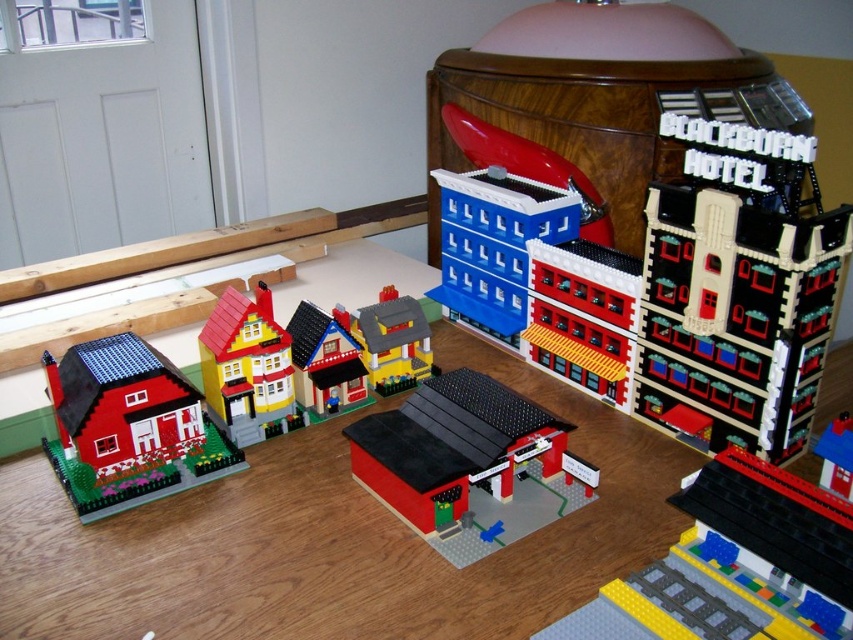
Question: Is wooden table at center thinner than yellow matte house at center-left?

Choices:
 (A) yes
 (B) no

Answer: (B)

Question: Which object appears closest to the camera in this image?

Choices:
 (A) yellow matte house at center
 (B) wooden table at center
 (C) smooth red carport at center

Answer: (B)

Question: Can you confirm if smooth red carport at center is bigger than yellow matte house at center?

Choices:
 (A) no
 (B) yes

Answer: (B)

Question: Which of the following is the farthest from the observer?

Choices:
 (A) yellow matte house at center-left
 (B) smooth red carport at center
 (C) yellow matte house at center

Answer: (C)

Question: Considering the real-world distances, which object is closest to the yellow matte house at center-left?

Choices:
 (A) matte plastic house at lower left
 (B) wooden table at center
 (C) smooth red carport at center
 (D) yellow matte house at center

Answer: (A)

Question: Does smooth red carport at center appear on the right side of yellow matte house at center?

Choices:
 (A) no
 (B) yes

Answer: (B)